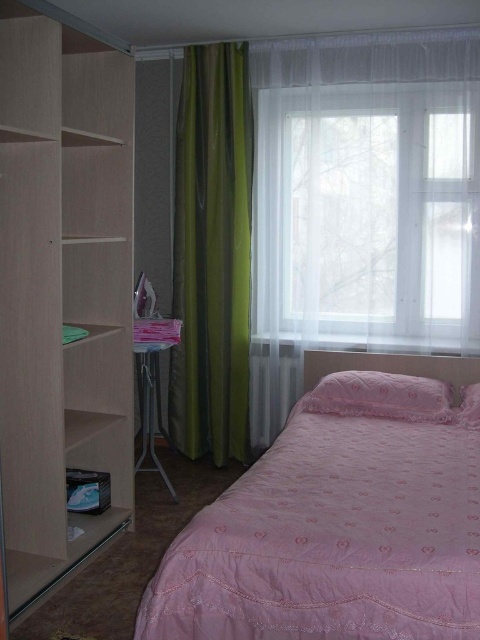
You are organizing a party in the bedroom and need to decide which item to move first. Since you want to start with the larger item, which one should you move first between the green sheer curtain at center and the pink satin pillow at right?

The green sheer curtain at center has a larger size compared to the pink satin pillow at right, so you should move the green sheer curtain at center first.

You are organizing a small party in the bedroom and need to place a rectangular table that is 1.2 meters wide. You have space near the pink quilted bed at lower right and the pink satin pillow at right. Which object allows placing the table next to it without the table overlapping?

The pink quilted bed at lower right has a larger width than the pink satin pillow at right, so placing the table next to the pink quilted bed at lower right would provide enough space without overlapping.